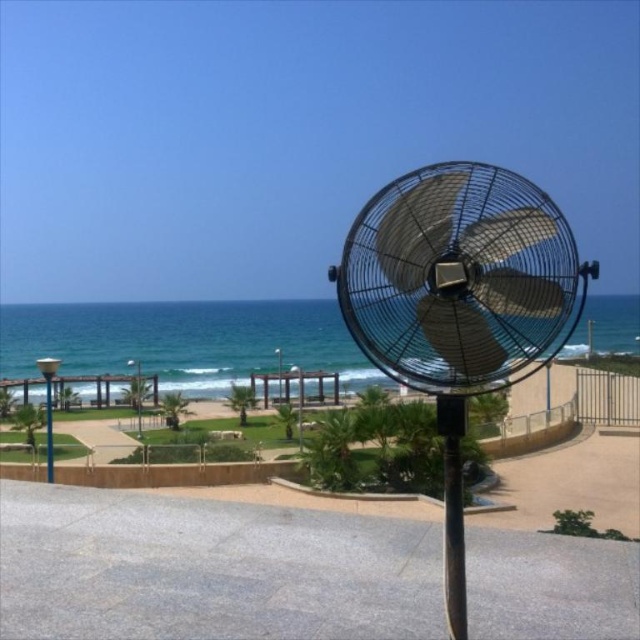
You are standing at the beach and see the black matte pole at center and the metallic pole at left. Which pole is closer to you?

The black matte pole at center is closer to you because it is in front of the metallic pole at left.

You are standing at the point labeled point (460, 301) in the image. Looking around, you see the metallic black fan at center. Which direction should you walk to reach the sandy beach area?

The point (460, 301) is at the metallic black fan at center. To reach the sandy beach area, you should walk towards the foreground, as the beach is in the background behind the fan.

You are a maintenance worker checking the height of the metallic black fan at center and the black matte pole at center. Which one is taller?

The metallic black fan at center is taller than the black matte pole at center.